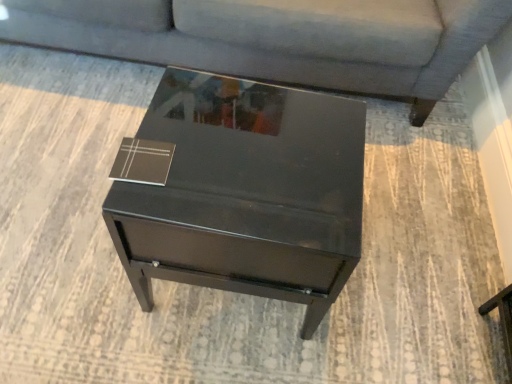
At what (x,y) coordinates should I click in order to perform the action: click on glossy black table at center. Please return your answer as a coordinate pair (x, y). Image resolution: width=512 pixels, height=384 pixels. Looking at the image, I should click on (246, 193).

This screenshot has height=384, width=512. Describe the element at coordinates (278, 38) in the screenshot. I see `matte gray couch at upper center` at that location.

Measure the distance between matte gray couch at upper center and camera.

The depth of matte gray couch at upper center is 1.16 meters.

Identify the location of brown leather book at upper left. (143, 161).

Locate an element on the screen. This screenshot has width=512, height=384. table on the right of brown leather book at upper left is located at coordinates (246, 193).

From the image's perspective, would you say glossy black table at center is shown under brown leather book at upper left?

Indeed, from the image's perspective, glossy black table at center is shown beneath brown leather book at upper left.

Based on the photo, can you confirm if glossy black table at center is taller than brown leather book at upper left?

Yes, glossy black table at center is taller than brown leather book at upper left.

Which is further, [36,30] or [150,176]?

The point [36,30] is farther from the camera.

From the picture: From the image's perspective, is matte gray couch at upper center above or below brown leather book at upper left?

Based on their image positions, matte gray couch at upper center is located above brown leather book at upper left.

You are a GUI agent. You are given a task and a screenshot of the screen. Output one action in this format:
    pyautogui.click(x=<x>, y=<y>)
    Task: Click on the square below the matte gray couch at upper center (from the image's perspective)
    Image resolution: width=512 pixels, height=384 pixels.
    Given the screenshot: What is the action you would take?
    pyautogui.click(x=143, y=161)

Between matte gray couch at upper center and brown leather book at upper left, which one has larger size?

matte gray couch at upper center is bigger.

Considering the relative sizes of glossy black table at center and matte gray couch at upper center in the image provided, is glossy black table at center thinner than matte gray couch at upper center?

Yes, glossy black table at center is thinner than matte gray couch at upper center.

The width and height of the screenshot is (512, 384). In order to click on studio couch above the glossy black table at center (from the image's perspective) in this screenshot , I will do `click(278, 38)`.

Does glossy black table at center have a larger size compared to matte gray couch at upper center?

Actually, glossy black table at center might be smaller than matte gray couch at upper center.

How much distance is there between brown leather book at upper left and glossy black table at center?

brown leather book at upper left and glossy black table at center are 7.94 inches apart from each other.

In the scene shown: Which of these two, brown leather book at upper left or glossy black table at center, stands shorter?

Standing shorter between the two is brown leather book at upper left.

Is brown leather book at upper left closer to the viewer compared to glossy black table at center?

That is False.

Is brown leather book at upper left positioned beyond the bounds of glossy black table at center?

That's correct, brown leather book at upper left is outside of glossy black table at center.

Where is `square above the matte gray couch at upper center (from a real-world perspective)`? square above the matte gray couch at upper center (from a real-world perspective) is located at coordinates (143, 161).

Is brown leather book at upper left facing towards matte gray couch at upper center?

No, brown leather book at upper left is not facing towards matte gray couch at upper center.

Between brown leather book at upper left and matte gray couch at upper center, which one is positioned in front?

brown leather book at upper left is closer to the camera.

Could you tell me if matte gray couch at upper center is turned towards glossy black table at center?

Yes, matte gray couch at upper center is aimed at glossy black table at center.

Is matte gray couch at upper center at the left side of glossy black table at center?

Indeed, matte gray couch at upper center is positioned on the left side of glossy black table at center.

Is matte gray couch at upper center spatially inside glossy black table at center, or outside of it?

The correct answer is: outside.

Where is `studio couch above the glossy black table at center (from a real-world perspective)`? The width and height of the screenshot is (512, 384). studio couch above the glossy black table at center (from a real-world perspective) is located at coordinates (278, 38).

Where is `square behind the glossy black table at center`? The height and width of the screenshot is (384, 512). square behind the glossy black table at center is located at coordinates (143, 161).

Image resolution: width=512 pixels, height=384 pixels. In order to click on square on the left of matte gray couch at upper center in this screenshot , I will do `click(143, 161)`.

Considering their positions, is brown leather book at upper left positioned further to glossy black table at center than matte gray couch at upper center?

Based on the image, matte gray couch at upper center appears to be further to glossy black table at center.

Based on their spatial positions, is matte gray couch at upper center or glossy black table at center closer to brown leather book at upper left?

glossy black table at center is closer to brown leather book at upper left.

Consider the image. From the image, which object appears to be nearer to matte gray couch at upper center, glossy black table at center or brown leather book at upper left?

Among the two, glossy black table at center is located nearer to matte gray couch at upper center.

Estimate the real-world distances between objects in this image. Which object is further from matte gray couch at upper center, brown leather book at upper left or glossy black table at center?

brown leather book at upper left is positioned further to the anchor matte gray couch at upper center.

Estimate the real-world distances between objects in this image. Which object is further from brown leather book at upper left, glossy black table at center or matte gray couch at upper center?

Answer: The object further to brown leather book at upper left is matte gray couch at upper center.

Estimate the real-world distances between objects in this image. Which object is further from glossy black table at center, matte gray couch at upper center or brown leather book at upper left?

matte gray couch at upper center lies further to glossy black table at center than the other object.

What are the coordinates of `square between matte gray couch at upper center and glossy black table at center from top to bottom` in the screenshot? It's located at (143, 161).